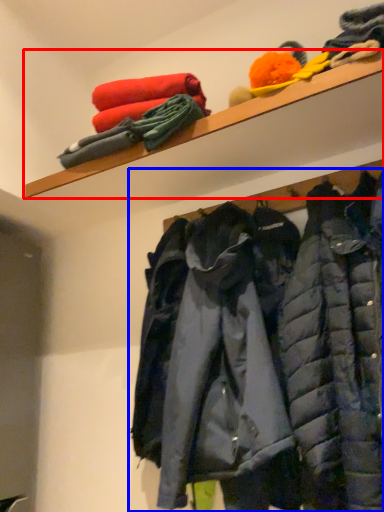
Question: Which of the following is the farthest to the observer, shelf (highlighted by a red box) or jacket (highlighted by a blue box)?

Choices:
 (A) shelf
 (B) jacket

Answer: (A)